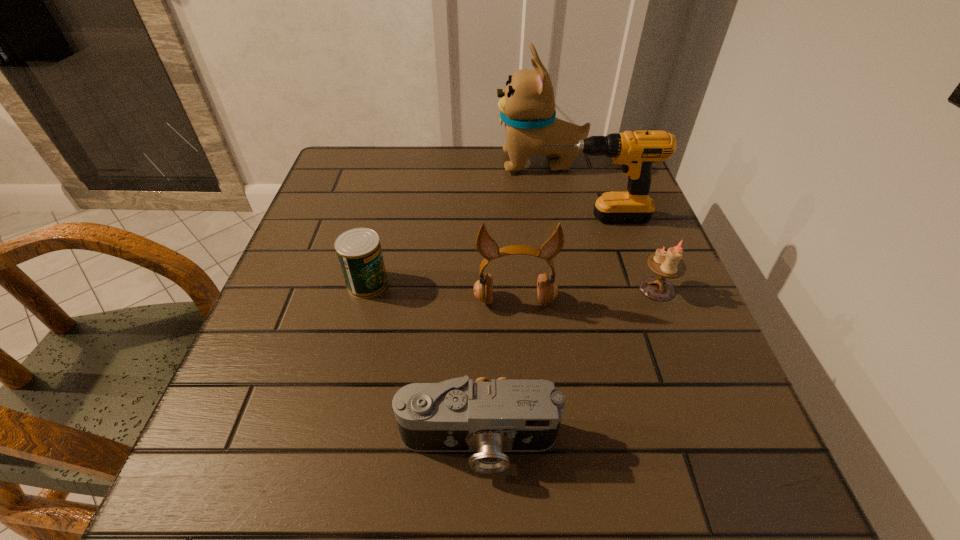
You are a GUI agent. You are given a task and a screenshot of the screen. Output one action in this format:
    pyautogui.click(x=<x>, y=<y>)
    Task: Click on the vacant space that satisfies the following two spatial constraints: 1. at the tip of the fifth nearest object; 2. on the lens of the camera
    
    Given the screenshot: What is the action you would take?
    pyautogui.click(x=660, y=442)

Where is `vacant region that satisfies the following two spatial constraints: 1. at the tip of the second farthest object; 2. on the right side of the candle holder`? vacant region that satisfies the following two spatial constraints: 1. at the tip of the second farthest object; 2. on the right side of the candle holder is located at coordinates (613, 289).

I want to click on vacant space that satisfies the following two spatial constraints: 1. on the back side of the fourth tallest object; 2. on the face of the farthest object, so click(608, 163).

Where is `vacant position in the image that satisfies the following two spatial constraints: 1. on the face of the farthest object; 2. on the front-facing side of the earphone`? The width and height of the screenshot is (960, 540). vacant position in the image that satisfies the following two spatial constraints: 1. on the face of the farthest object; 2. on the front-facing side of the earphone is located at coordinates (564, 301).

I want to click on vacant space that satisfies the following two spatial constraints: 1. at the tip of the second farthest object; 2. on the lens of the camera, so click(x=660, y=442).

At what (x,y) coordinates should I click in order to perform the action: click on vacant area in the image that satisfies the following two spatial constraints: 1. on the face of the farthest object; 2. on the front-facing side of the earphone. Please return your answer as a coordinate pair (x, y). The image size is (960, 540). Looking at the image, I should click on (564, 301).